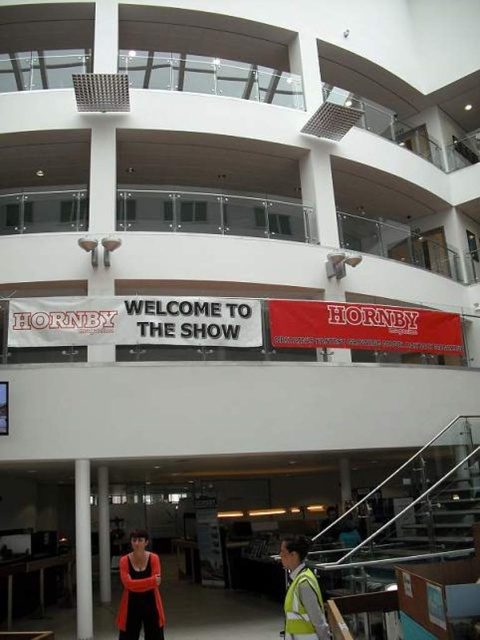
You are a photographer setting up equipment in the entrance area. You need to place a wide camera tripod between the white glossy pillar at lower center and the white glossy pillar at center. Considering their widths, will the space between them accommodate the tripod?

The white glossy pillar at lower center is wider than the white glossy pillar at center. Therefore, the space between them may be sufficient to place the tripod, but since the exact distance isn

You are a photographer setting up equipment in the entrance area. You need to place a large camera tripod that requires 3 meters of space. You see the white glossy pillar at lower center and the white glossy pillar at center. Which pillar should you avoid placing the tripod near to ensure enough space?

You should avoid placing the tripod near the white glossy pillar at lower center because it has a larger size compared to the white glossy pillar at center, meaning there is less space around it for the tripod.

You are a visitor entering the building and need to locate the reflective yellow safety vest at lower center. According to the scene, where would you find it in relation to the white glossy pillar at center?

The reflective yellow safety vest at lower center is to the right of the white glossy pillar at center.